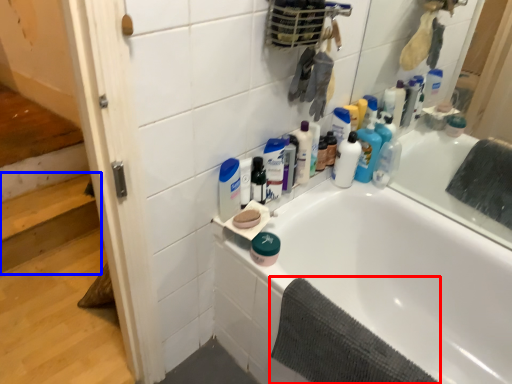
Question: Which of the following is the closest to the observer, bath towel (highlighted by a red box) or stairwell (highlighted by a blue box)?

Choices:
 (A) bath towel
 (B) stairwell

Answer: (A)